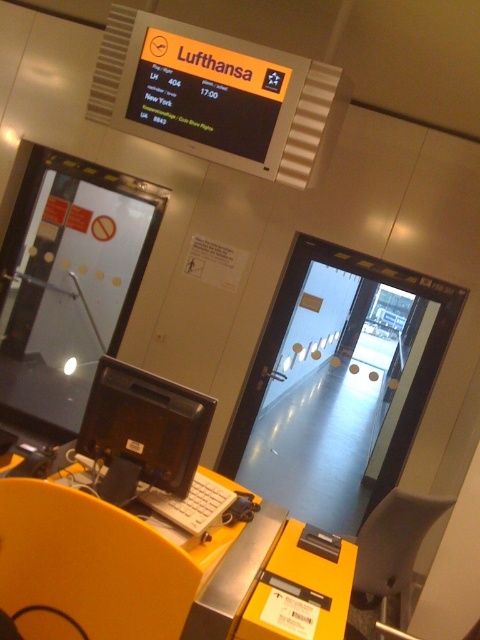
You are a traveler standing at the checkin counter and see the yellow plastic table at lower left and the yellow plastic chair at lower left. Which one is more to the right?

The yellow plastic table at lower left is positioned on the right side of yellow plastic chair at lower left, so the yellow plastic table at lower left is more to the right.

You are a traveler standing at the airport terminal and want to check the flight information. Where exactly is the black plastic monitor at lower center located in the scene?

The black plastic monitor at lower center is located at point coordinates of (143, 429).